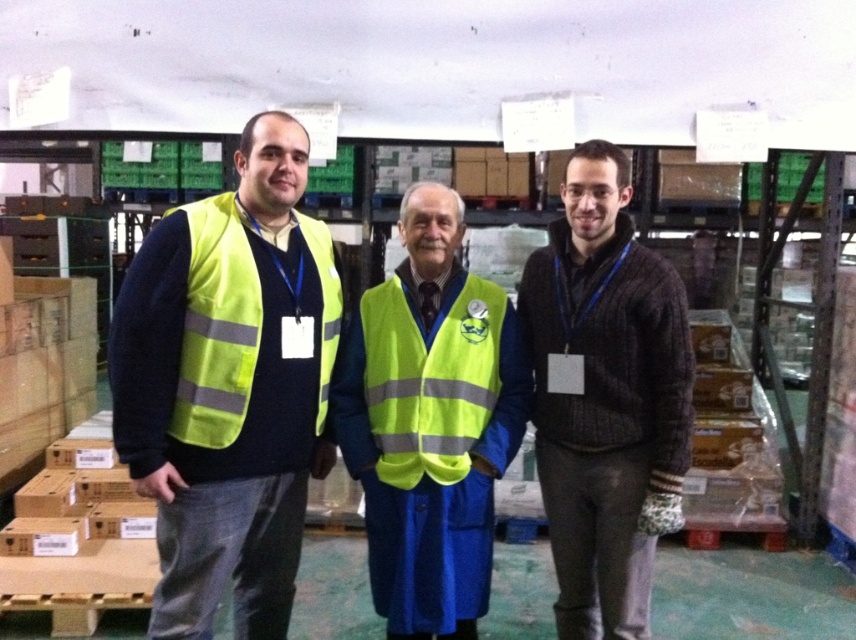
In the image of the warehouse with shelves and boxes, there is a knitted sweater at center. Where exactly is the knitted sweater located in terms of coordinates?

The knitted sweater at center is located at point coordinates of (605, 396).